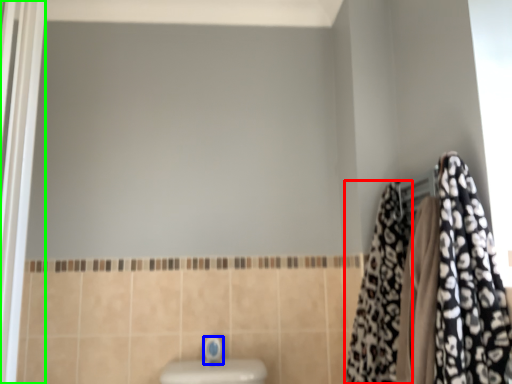
Question: Considering the real-world distances, which object is closest to cloth (highlighted by a red box)? faucet (highlighted by a blue box) or screen door (highlighted by a green box).

Choices:
 (A) faucet
 (B) screen door

Answer: (A)